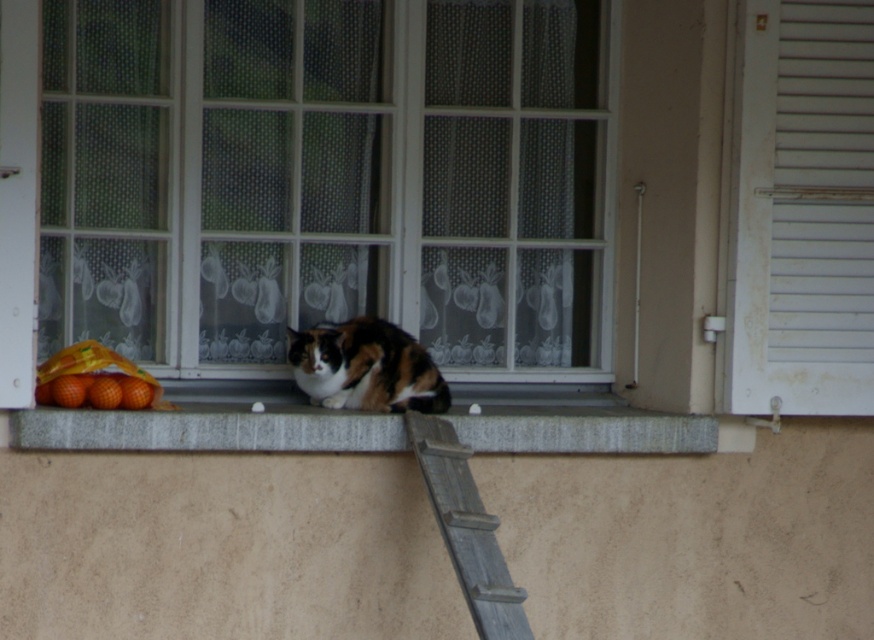
In the scene shown: Who is more forward, (833, 17) or (30, 438)?

Positioned in front is point (30, 438).

Is white painted wood shutter at right in front of gray stone window sill at center?

No, white painted wood shutter at right is behind gray stone window sill at center.

Identify the location of white painted wood shutter at right. The height and width of the screenshot is (640, 874). (822, 182).

I want to click on white painted wood shutter at right, so click(x=822, y=182).

Can you confirm if clear glass window at center is positioned below gray stone window sill at center?

Incorrect, clear glass window at center is not positioned below gray stone window sill at center.

Is clear glass window at center further to camera compared to gray stone window sill at center?

That is True.

Where is `clear glass window at center`? The height and width of the screenshot is (640, 874). clear glass window at center is located at coordinates (325, 177).

Can you confirm if clear glass window at center is wider than white painted wood shutter at right?

Correct, the width of clear glass window at center exceeds that of white painted wood shutter at right.

I want to click on clear glass window at center, so click(x=325, y=177).

The width and height of the screenshot is (874, 640). Describe the element at coordinates (325, 177) in the screenshot. I see `clear glass window at center` at that location.

Find the location of a particular element. The height and width of the screenshot is (640, 874). clear glass window at center is located at coordinates pos(325,177).